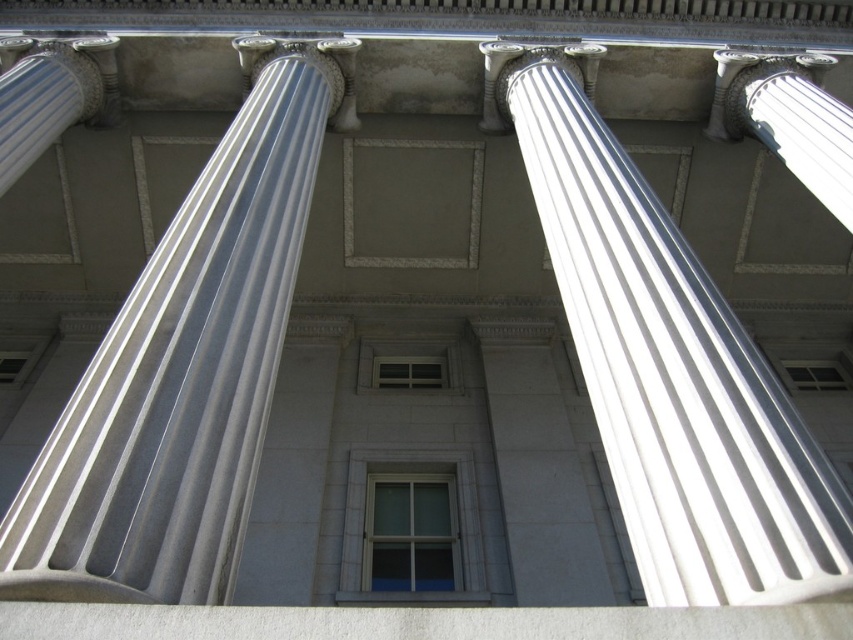
You are standing in front of the classical architectural structure described. You want to take a photo of the white glossy column at center. Where should you aim your camera to capture the column in the frame?

You should aim your camera at the point with coordinates 0.577 on the x axis and 0.217 on the y axis to capture the white glossy column at center in the frame.

You are standing in front of the classical structure and want to determine the spatial relationship between two points marked in the scene. Which point is closer to you, point (616,308) or point (791,161)?

Point (616,308) is in front of point (791,161), so it is closer to you.